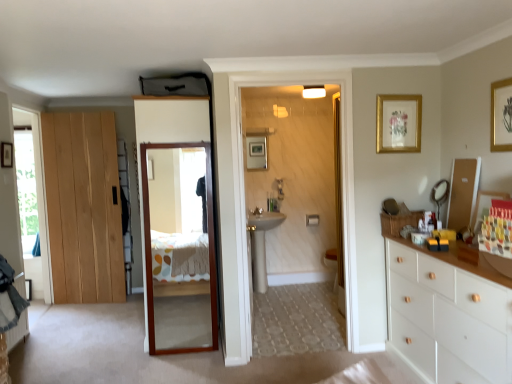
Image resolution: width=512 pixels, height=384 pixels. I want to click on matte black mirror at right, which is the 1th mirror in back-to-front order, so point(440,194).

Measure the distance between point (x=469, y=323) and camera.

They are 6.87 feet apart.

Image resolution: width=512 pixels, height=384 pixels. I want to click on matte black mirror at right, the 2th mirror in the front-to-back sequence, so click(440, 194).

There is a transparent glass window at left, marked as the second window in a back-to-front arrangement. Where is `the 1st door below it (from a real-world perspective)`? the 1st door below it (from a real-world perspective) is located at coordinates (83, 207).

From a real-world perspective, between light wood door at left, the 1th door when ordered from left to right, and transparent glass window at left, which is the first window in front-to-back order, who is vertically higher?

transparent glass window at left, which is the first window in front-to-back order, from a real-world perspective.

Considering the positions of objects light wood door at left, which is the 2th door in right-to-left order, and transparent glass window at left, arranged as the 2th window when viewed from the left, in the image provided, who is more to the left, light wood door at left, which is the 2th door in right-to-left order, or transparent glass window at left, arranged as the 2th window when viewed from the left,?

From the viewer's perspective, transparent glass window at left, arranged as the 2th window when viewed from the left, appears more on the left side.

Consider the image. Which object is closer to the camera, light wood door at left, which is the 2th door in right-to-left order, or transparent glass window at left, the first window from the right?

transparent glass window at left, the first window from the right.

Would you say gold-framed artwork at upper right, marked as the 2th picture frame in a left-to-right arrangement, is outside transparent glass window at left, marked as the second window in a back-to-front arrangement?

Yes, gold-framed artwork at upper right, marked as the 2th picture frame in a left-to-right arrangement, is not within transparent glass window at left, marked as the second window in a back-to-front arrangement.

Is point (398, 113) positioned behind point (32, 123)?

No, (398, 113) is closer to viewer.

Is gold-framed artwork at upper right, the 2th picture frame when ordered from right to left, not close to transparent glass window at left, arranged as the 2th window when viewed from the left?

Yes, gold-framed artwork at upper right, the 2th picture frame when ordered from right to left, and transparent glass window at left, arranged as the 2th window when viewed from the left, are quite far apart.

In the scene shown: From a real-world perspective, is gold-framed artwork at upper right, which is counted as the 2th picture frame, starting from the back, physically above transparent glass window at left, which is the first window in front-to-back order?

Yes, from a real-world perspective, gold-framed artwork at upper right, which is counted as the 2th picture frame, starting from the back, is over transparent glass window at left, which is the first window in front-to-back order

Would you say clear glass window at left, which is the 2th window in right-to-left order, contains gold-framed artwork at upper right, which is counted as the 2th picture frame, starting from the back?

Definitely not — gold-framed artwork at upper right, which is counted as the 2th picture frame, starting from the back, is not inside clear glass window at left, which is the 2th window in right-to-left order.

Who is bigger, clear glass window at left, placed as the 1th window when sorted from back to front, or gold-framed artwork at upper right, the 2th picture frame when ordered from right to left?

With larger size is clear glass window at left, placed as the 1th window when sorted from back to front.

How different are the orientations of clear glass window at left, which is the 2th window in right-to-left order, and gold-framed artwork at upper right, which is counted as the 2th picture frame, starting from the back, in degrees?

The angular difference between clear glass window at left, which is the 2th window in right-to-left order, and gold-framed artwork at upper right, which is counted as the 2th picture frame, starting from the back, is 0.228 degrees.

From the image's perspective, which is above, clear glass window at left, placed as the 1th window when sorted from back to front, or gold-framed artwork at upper right, which is counted as the 2th picture frame, starting from the back?

From the image's view, gold-framed artwork at upper right, which is counted as the 2th picture frame, starting from the back, is above.

In the image, is wooden-framed mirror at right, acting as the second mirror starting from the back, positioned in front of or behind matte black picture frame at upper left, which appears as the first picture frame when viewed from the back?

In the image, wooden-framed mirror at right, acting as the second mirror starting from the back, appears in front of matte black picture frame at upper left, which appears as the first picture frame when viewed from the back.

From the matte black picture frame at upper left, which appears as the first picture frame when viewed from the back, count 2nd mirror to the right and point to it. Please provide its 2D coordinates.

[(463, 192)]

Which object is positioned more to the left, wooden-framed mirror at right, which ranks as the 1th mirror in front-to-back order, or matte black picture frame at upper left, which appears as the first picture frame when viewed from the left?

matte black picture frame at upper left, which appears as the first picture frame when viewed from the left, is more to the left.

Considering the sizes of wooden-framed mirror at right, acting as the second mirror starting from the back, and matte black picture frame at upper left, which appears as the first picture frame when viewed from the left, in the image, is wooden-framed mirror at right, acting as the second mirror starting from the back, taller or shorter than matte black picture frame at upper left, which appears as the first picture frame when viewed from the left,?

Considering their sizes, wooden-framed mirror at right, acting as the second mirror starting from the back, has more height than matte black picture frame at upper left, which appears as the first picture frame when viewed from the left.

Does white wood chest of drawers at right have a greater width compared to gold-framed picture at upper right, which ranks as the first picture frame in right-to-left order?

Yes.

Between white wood chest of drawers at right and gold-framed picture at upper right, which ranks as the first picture frame in right-to-left order, which one appears on the left side from the viewer's perspective?

From the viewer's perspective, white wood chest of drawers at right appears more on the left side.

Is white wood chest of drawers at right not within gold-framed picture at upper right, marked as the 1th picture frame in a front-to-back arrangement?

white wood chest of drawers at right lies outside gold-framed picture at upper right, marked as the 1th picture frame in a front-to-back arrangement,'s area.

Is white wood chest of drawers at right facing towards gold-framed picture at upper right, which ranks as the first picture frame in right-to-left order?

No, white wood chest of drawers at right is not oriented towards gold-framed picture at upper right, which ranks as the first picture frame in right-to-left order.

Considering the points (254, 283) and (439, 192), which point is behind, point (254, 283) or point (439, 192)?

The point (254, 283) is farther.

How many degrees apart are the facing directions of white ceramic sink at center and matte black mirror at right, which is the 1th mirror in back-to-front order?

89.4 degrees separate the facing orientations of white ceramic sink at center and matte black mirror at right, which is the 1th mirror in back-to-front order.

Measure the distance between white ceramic sink at center and matte black mirror at right, the 2th mirror in the front-to-back sequence.

white ceramic sink at center and matte black mirror at right, the 2th mirror in the front-to-back sequence, are 7.04 feet apart from each other.

Is white ceramic sink at center facing away from matte black mirror at right, the 2th mirror in the front-to-back sequence?

white ceramic sink at center is not turned away from matte black mirror at right, the 2th mirror in the front-to-back sequence.

Can you confirm if clear glass window at left, which is the 2th window in right-to-left order, is smaller than matte black picture frame at upper left, which appears as the first picture frame when viewed from the left?

No, clear glass window at left, which is the 2th window in right-to-left order, is not smaller than matte black picture frame at upper left, which appears as the first picture frame when viewed from the left.

At what (x,y) coordinates should I click in order to perform the action: click on picture frame that is the 1st one when counting forward from the clear glass window at left, positioned as the first window in left-to-right order. Please return your answer as a coordinate pair (x, y). This screenshot has height=384, width=512. Looking at the image, I should click on (6, 155).

From the image's perspective, between clear glass window at left, positioned as the first window in left-to-right order, and matte black picture frame at upper left, marked as the third picture frame in a front-to-back arrangement, which one is located above?

matte black picture frame at upper left, marked as the third picture frame in a front-to-back arrangement, appears higher in the image.

Considering the sizes of objects clear glass window at left, which is the 2th window in right-to-left order, and matte black picture frame at upper left, which appears as the first picture frame when viewed from the left, in the image provided, who is taller, clear glass window at left, which is the 2th window in right-to-left order, or matte black picture frame at upper left, which appears as the first picture frame when viewed from the left,?

With more height is clear glass window at left, which is the 2th window in right-to-left order.

Find the location of a particular element. The width and height of the screenshot is (512, 384). the 1st window above the light wood door at left, the 1th door when ordered from left to right (from a real-world perspective) is located at coordinates (32, 201).

Which window is the 1st one when counting from the back of the gold-framed artwork at upper right, the 2th picture frame when ordered from right to left? Please provide its 2D coordinates.

[(32, 201)]

When comparing their distances from matte black mirror at right, which is the 1th mirror in back-to-front order, does white ceramic sink at center or wooden mirror at center, positioned as the 2th door in back-to-front order, seem further?

white ceramic sink at center is positioned further to the anchor matte black mirror at right, which is the 1th mirror in back-to-front order.

Estimate the real-world distances between objects in this image. Which object is further from matte black picture frame at upper left, the third picture frame in the right-to-left sequence, white wood chest of drawers at right or matte black mirror at right, which is the 1th mirror in back-to-front order?

white wood chest of drawers at right lies further to matte black picture frame at upper left, the third picture frame in the right-to-left sequence, than the other object.

When comparing their distances from gold-framed artwork at upper right, marked as the 2th picture frame in a left-to-right arrangement, does matte black mirror at right, which is the 1th mirror in back-to-front order, or wooden-framed mirror at right, which ranks as the 1th mirror in front-to-back order, seem closer?

Based on the image, matte black mirror at right, which is the 1th mirror in back-to-front order, appears to be nearer to gold-framed artwork at upper right, marked as the 2th picture frame in a left-to-right arrangement.

When comparing their distances from clear glass window at left, positioned as the first window in left-to-right order, does light wood door at left, the first door from the back, or gold-framed artwork at upper right, marked as the 2th picture frame in a left-to-right arrangement, seem closer?

light wood door at left, the first door from the back, is closer to clear glass window at left, positioned as the first window in left-to-right order.

Estimate the real-world distances between objects in this image. Which object is closer to wooden-framed mirror at right, acting as the second mirror starting from the back, wooden mirror at center, positioned as the first door in front-to-back order, or transparent glass window at left, which is the first window in front-to-back order?

Based on the image, wooden mirror at center, positioned as the first door in front-to-back order, appears to be nearer to wooden-framed mirror at right, acting as the second mirror starting from the back.

Based on their spatial positions, is wooden-framed mirror at right, which ranks as the 1th mirror in front-to-back order, or clear glass window at left, placed as the 1th window when sorted from back to front, closer to gold-framed artwork at upper right, the 2th picture frame when ordered from right to left?

wooden-framed mirror at right, which ranks as the 1th mirror in front-to-back order, is positioned closer to the anchor gold-framed artwork at upper right, the 2th picture frame when ordered from right to left.

When comparing their distances from transparent glass window at left, arranged as the 2th window when viewed from the left, does wooden mirror at center, the second door positioned from the left, or gold-framed picture at upper right, marked as the 1th picture frame in a front-to-back arrangement, seem closer?

Among the two, wooden mirror at center, the second door positioned from the left, is located nearer to transparent glass window at left, arranged as the 2th window when viewed from the left.

Looking at the image, which one is located closer to clear glass window at left, placed as the 1th window when sorted from back to front, matte black mirror at right, which is the 1th mirror in back-to-front order, or gold-framed picture at upper right, the third picture frame when ordered from back to front?

matte black mirror at right, which is the 1th mirror in back-to-front order.

You are a GUI agent. You are given a task and a screenshot of the screen. Output one action in this format:
    pyautogui.click(x=<x>, y=<y>)
    Task: Click on the mirror that lies between gold-framed artwork at upper right, which is counted as the 2th picture frame, starting from the back, and matte black mirror at right, which is the 1th mirror in back-to-front order, from top to bottom
    
    Given the screenshot: What is the action you would take?
    pyautogui.click(x=463, y=192)

At what (x,y) coordinates should I click in order to perform the action: click on mirror located between wooden mirror at center, the second door positioned from the left, and wooden-framed mirror at right, acting as the second mirror starting from the back, in the left-right direction. Please return your answer as a coordinate pair (x, y). Image resolution: width=512 pixels, height=384 pixels. Looking at the image, I should click on (440, 194).

Image resolution: width=512 pixels, height=384 pixels. Find the location of `door located between matte black picture frame at upper left, the third picture frame in the right-to-left sequence, and clear glass window at left, which is the 2th window in right-to-left order, in the depth direction`. door located between matte black picture frame at upper left, the third picture frame in the right-to-left sequence, and clear glass window at left, which is the 2th window in right-to-left order, in the depth direction is located at coordinates [83, 207].

The width and height of the screenshot is (512, 384). What are the coordinates of `sink between light wood door at left, the 1th door when ordered from left to right, and matte black mirror at right, which is the 1th mirror in back-to-front order` in the screenshot? It's located at [x=261, y=245].